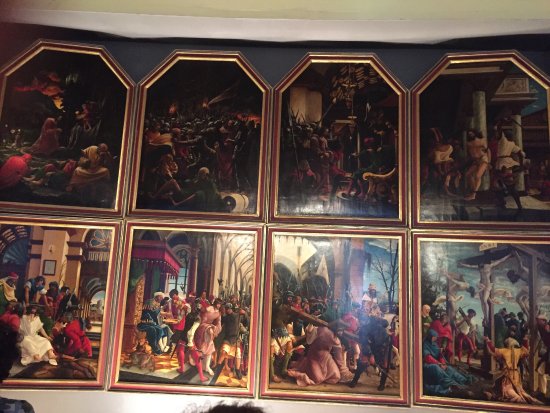
Find the location of a particular element. This screenshot has height=413, width=550. picture is located at coordinates (84, 373).